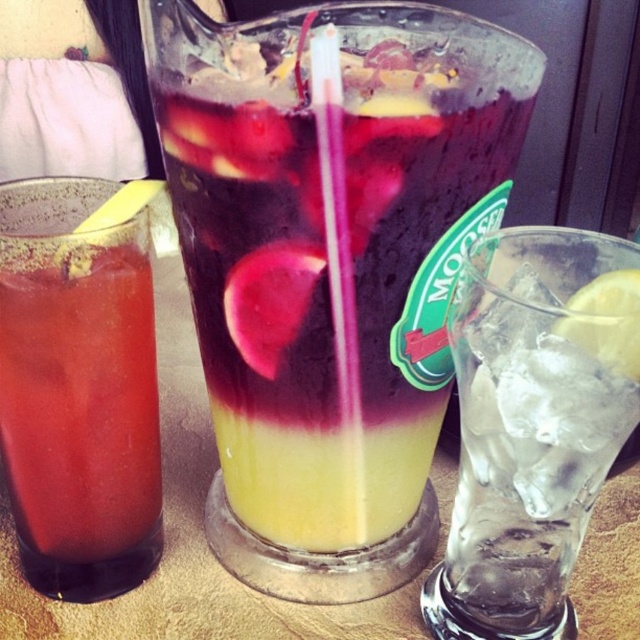
Based on the scene description, where is the translucent glass at center located in the image?

The translucent glass at center is located at point (326, 266) in the image.

You are holding a small toy that is 20 centimeters long. You want to place it on the table so that it points directly towards the point at coordinates [124,422]. Will the entire toy fit on the table if the table is 25 centimeters long from your current position to that point?

The distance from your current position to the point is 22.75 centimeters. Since the toy is 20 centimeters long, it will fit as the distance is slightly longer than the toy.